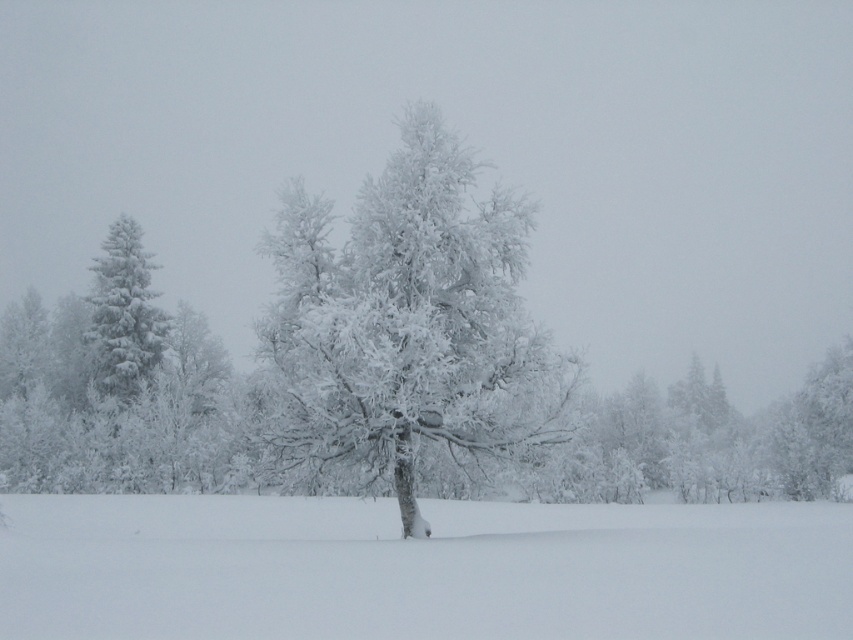
Is white frosty tree at center bigger than white frosty tree at left?

Indeed, white frosty tree at center has a larger size compared to white frosty tree at left.

Does white frosty tree at center appear under white frosty tree at left?

Yes.

Who is more forward, (334,454) or (106,246)?

Point (334,454)

Where is `white frosty tree at center`? The image size is (853, 640). white frosty tree at center is located at coordinates (409, 321).

Can you confirm if white fluffy snow at center is smaller than white frosty tree at left?

No.

Does point (577, 506) lie behind point (138, 317)?

No.

Is point (509, 515) closer to viewer compared to point (151, 330)?

That is True.

Locate an element on the screen. The height and width of the screenshot is (640, 853). white fluffy snow at center is located at coordinates (419, 568).

Does white fluffy snow at center appear over white frosty tree at center?

No.

Between white fluffy snow at center and white frosty tree at center, which one is positioned higher?

white frosty tree at center is higher up.

Identify the location of white fluffy snow at center. The height and width of the screenshot is (640, 853). (419, 568).

You are a GUI agent. You are given a task and a screenshot of the screen. Output one action in this format:
    pyautogui.click(x=<x>, y=<y>)
    Task: Click on the white fluffy snow at center
    This screenshot has width=853, height=640.
    Given the screenshot: What is the action you would take?
    pyautogui.click(x=419, y=568)